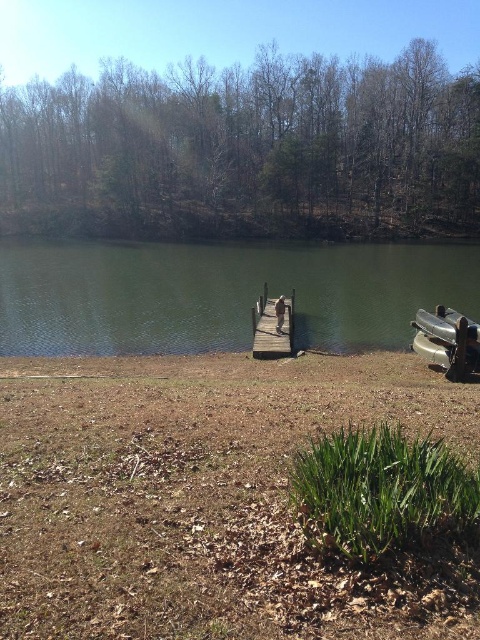
You are standing at the brown dry grass at lower left and want to reach the metallic gray boat at lower right. The path between them is straight. If you walk at a constant speed of 3 feet per second, how long will it take you to reach the boat?

The distance between the brown dry grass at lower left and the metallic gray boat at lower right is 42.04 feet. Walking at 3 feet per second, the time required is 42.04 divided by 3, which equals approximately 14.01 seconds. So, it will take about 14 seconds to reach the boat.

You are standing at the lakeside and want to walk to the end of the wooden dock at center. However, you notice that the green smooth water at center is wider than the dock. Will you be able to walk straight to the end without stepping into the water?

The green smooth water at center is wider than the wooden dock at center, so walking straight might lead you into the water. The dock is narrower than the water area, so staying on the dock requires careful steps to avoid the edges.